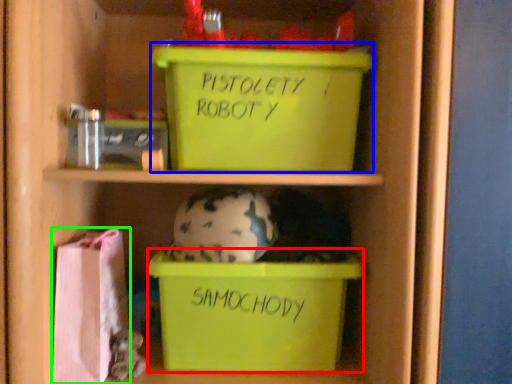
Question: Which is nearer to the storage box (highlighted by a red box)? storage box (highlighted by a blue box) or material (highlighted by a green box).

Choices:
 (A) storage box
 (B) material

Answer: (B)